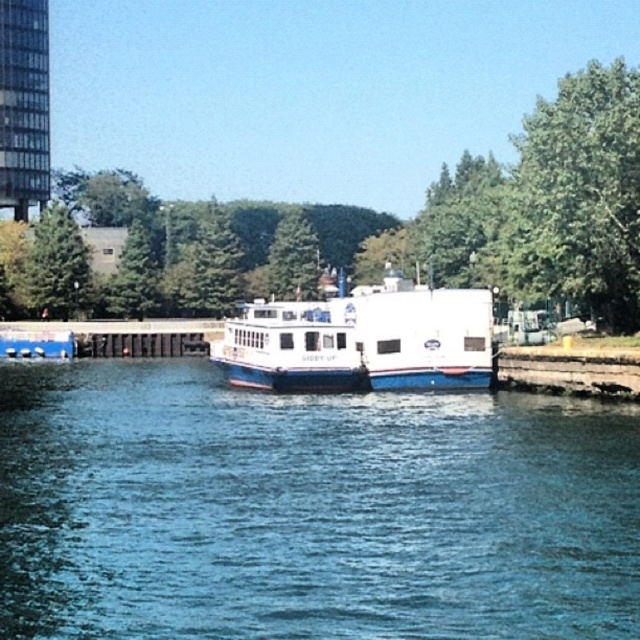
Which is below, green leafy tree at upper right or white matte boat at center?

white matte boat at center is lower down.

Is point (572, 253) closer to camera compared to point (260, 348)?

Yes, point (572, 253) is closer to viewer.

You are a GUI agent. You are given a task and a screenshot of the screen. Output one action in this format:
    pyautogui.click(x=<x>, y=<y>)
    Task: Click on the green leafy tree at upper right
    Image resolution: width=640 pixels, height=640 pixels.
    Given the screenshot: What is the action you would take?
    pyautogui.click(x=580, y=195)

Does white matte boat at center appear under green matte tree at upper left?

Yes, white matte boat at center is below green matte tree at upper left.

Can you confirm if white matte boat at center is positioned to the left of green matte tree at upper left?

Incorrect, white matte boat at center is not on the left side of green matte tree at upper left.

Describe the element at coordinates (362, 340) in the screenshot. I see `white matte boat at center` at that location.

Image resolution: width=640 pixels, height=640 pixels. I want to click on white matte boat at center, so click(362, 340).

Can you confirm if blue glossy water at center is smaller than green matte tree at upper left?

Yes.

Which is more to the left, blue glossy water at center or green matte tree at upper left?

green matte tree at upper left is more to the left.

Between point (372, 467) and point (86, 280), which one is positioned in front?

Positioned in front is point (372, 467).

Identify the location of blue glossy water at center. The image size is (640, 640). (312, 513).